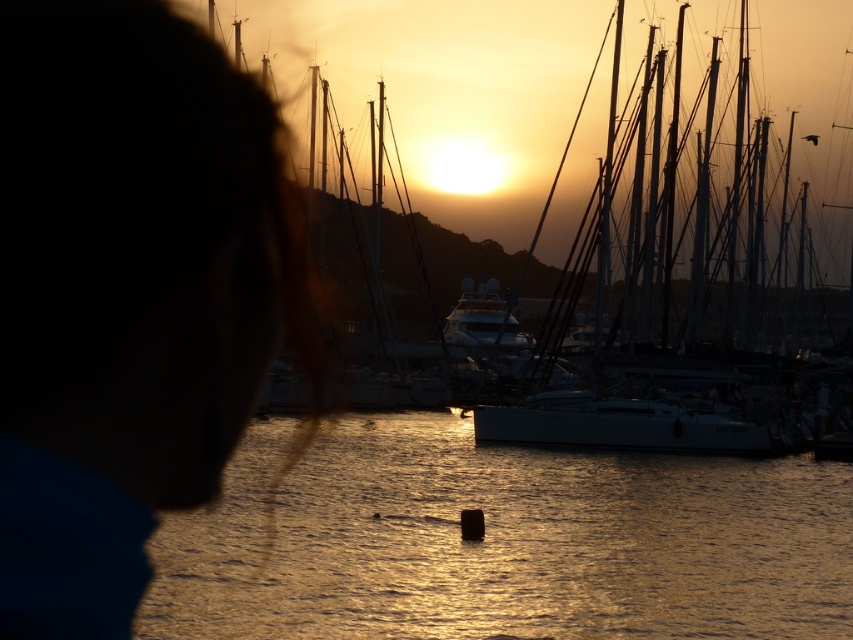
Image resolution: width=853 pixels, height=640 pixels. Find the location of `silky blue hair at upper left`. silky blue hair at upper left is located at coordinates pos(126,294).

Looking at this image, can you confirm if silky blue hair at upper left is positioned to the right of white matte sailboat at center?

No, silky blue hair at upper left is not to the right of white matte sailboat at center.

Who is more forward, (105, 605) or (653, 412)?

Point (105, 605)

This screenshot has width=853, height=640. In order to click on silky blue hair at upper left in this screenshot , I will do `click(126, 294)`.

Does silky blue hair at upper left appear under glossy water at center?

No.

Does point (22, 572) lie behind point (485, 531)?

No, it is not.

Consider the image. Who is more forward, (15,509) or (822,625)?

Positioned in front is point (15,509).

The height and width of the screenshot is (640, 853). I want to click on silky blue hair at upper left, so click(126, 294).

Can you confirm if glossy water at center is positioned to the left of white matte sailboat at center?

Correct, you'll find glossy water at center to the left of white matte sailboat at center.

Is glossy water at center thinner than white matte sailboat at center?

Indeed, glossy water at center has a lesser width compared to white matte sailboat at center.

Does point (786, 504) come farther from viewer compared to point (676, 113)?

No, (786, 504) is closer to viewer.

Identify the location of glossy water at center. The image size is (853, 640). (503, 541).